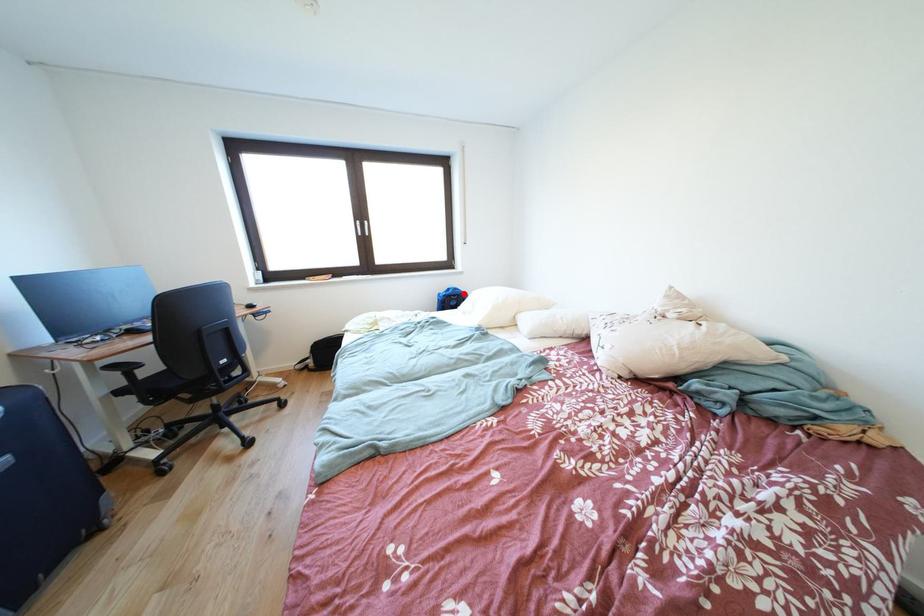
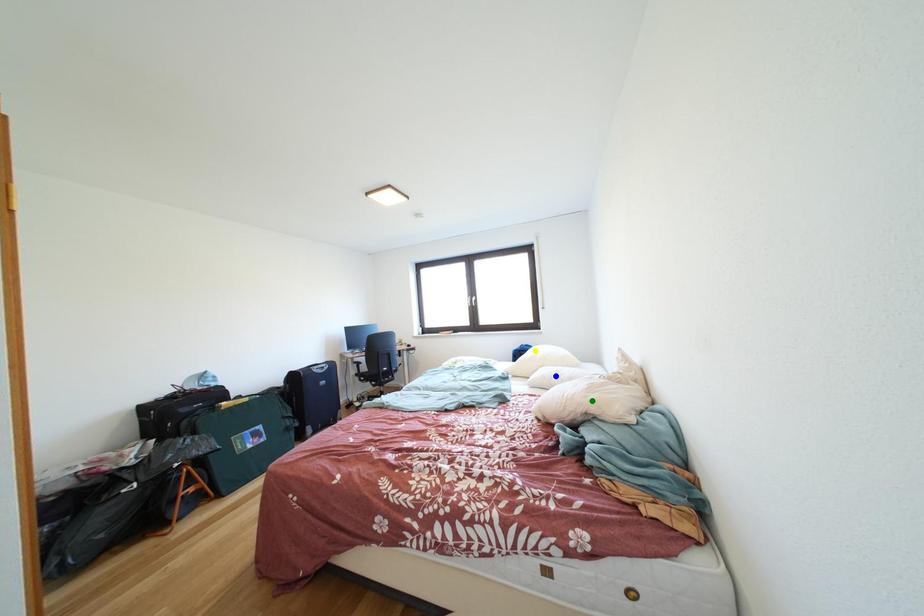
Question: I am providing you with two images of the same scene from different viewpoints. A red point is marked on the first image. You are given multiple points on the second image. In image 2, which mark is for the same physical point as the one in image 1?

Choices:
 (A) blue point
 (B) yellow point
 (C) green point

Answer: (B)